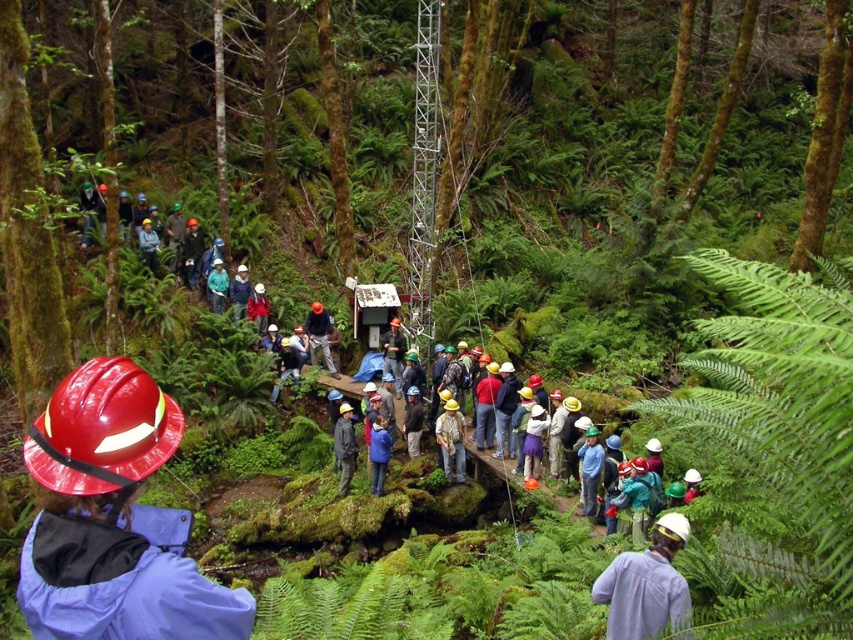
Is white matte helmet at center to the left of green matte jacket at center from the viewer's perspective?

In fact, white matte helmet at center is to the right of green matte jacket at center.

Which of these two, white matte helmet at center or green matte jacket at center, stands taller?

Standing taller between the two is green matte jacket at center.

Which is in front, point (630, 593) or point (210, 296)?

Point (630, 593) is in front.

You are a GUI agent. You are given a task and a screenshot of the screen. Output one action in this format:
    pyautogui.click(x=<x>, y=<y>)
    Task: Click on the white matte helmet at center
    This screenshot has height=640, width=853.
    Given the screenshot: What is the action you would take?
    pyautogui.click(x=646, y=586)

Is point (440, 429) less distant than point (384, 428)?

No, (440, 429) is further to viewer.

Measure the distance between point (444, 426) and camera.

The distance of point (444, 426) from camera is 15.64 meters.

The image size is (853, 640). What are the coordinates of `camouflage fabric shirt at center` in the screenshot? It's located at (451, 440).

Locate an element on the screen. camouflage fabric shirt at center is located at coordinates (451, 440).

Between white matte helmet at center and matte red jacket at center, which one is positioned higher?

matte red jacket at center is above.

Does point (650, 593) come behind point (254, 284)?

That is False.

At what (x,y) coordinates should I click in order to perform the action: click on white matte helmet at center. Please return your answer as a coordinate pair (x, y). The height and width of the screenshot is (640, 853). Looking at the image, I should click on (646, 586).